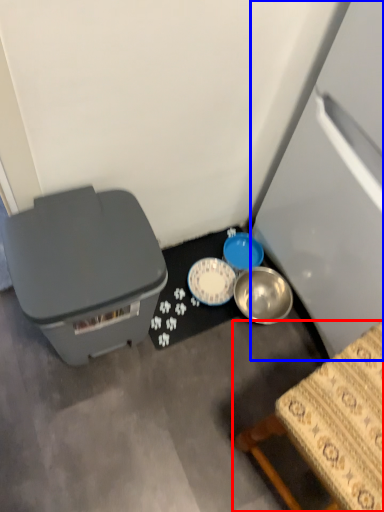
Question: Which object appears closest to the camera in this image, furniture (highlighted by a red box) or refrigerator (highlighted by a blue box)?

Choices:
 (A) furniture
 (B) refrigerator

Answer: (B)